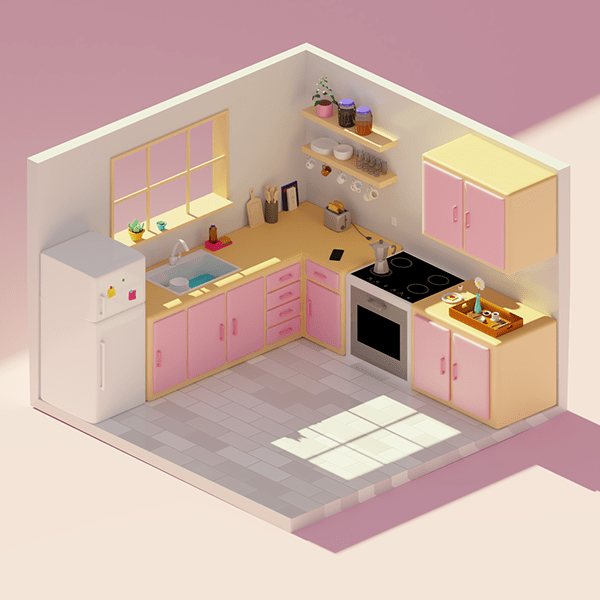
Locate an element on the screen. This screenshot has height=600, width=600. gray toaster is located at coordinates click(336, 220).